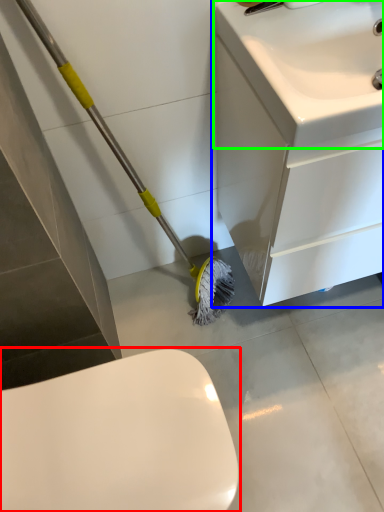
Question: Which object is the closest to the toilet (highlighted by a red box)? Choose among these: bathroom cabinet (highlighted by a blue box) or sink (highlighted by a green box).

Choices:
 (A) bathroom cabinet
 (B) sink

Answer: (A)